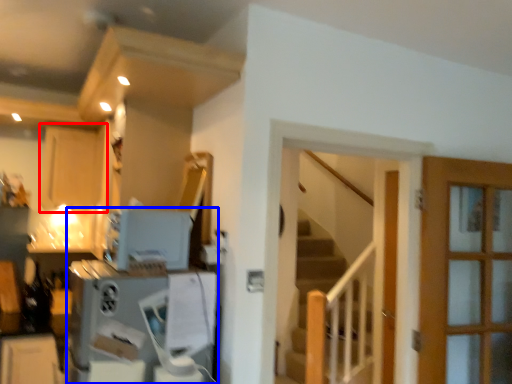
Question: Which point is further to the camera, cabinetry (highlighted by a red box) or appliance (highlighted by a blue box)?

Choices:
 (A) cabinetry
 (B) appliance

Answer: (A)